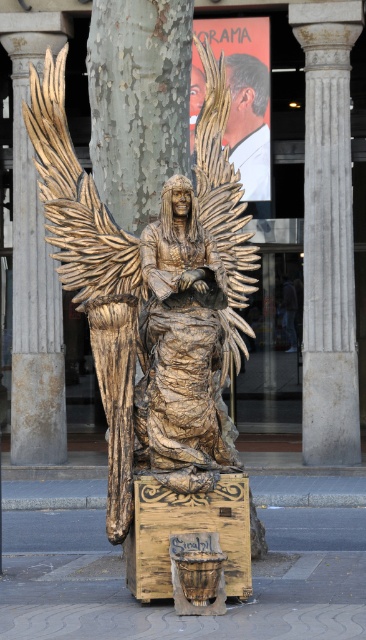
You are an art curator assessing the placement of the wooden statue at center and the smooth skin at upper center for a new exhibition. Based on their positions, which object would visitors see first when entering the room?

The wooden statue at center is in front of the smooth skin at upper center, so visitors would see the wooden statue at center first as it is closer to the entrance.

You are standing at the center of the image and want to move to the wooden statue at center. Which direction should you move?

The wooden statue at center is already at the center point of the image, so you are already at the correct location.

You are an architect designing a new public plaza. You want to place a statue of a lifeless angel with outstretched wings in the plaza. The statue must be placed between the white marble column at center and the smooth skin at upper center. Which object should the statue be placed closer to, considering their sizes?

The statue should be placed closer to the white marble column at center because it is larger in size than the smooth skin at upper center, so the statue would need more space near the larger object to maintain balance in the plaza design.